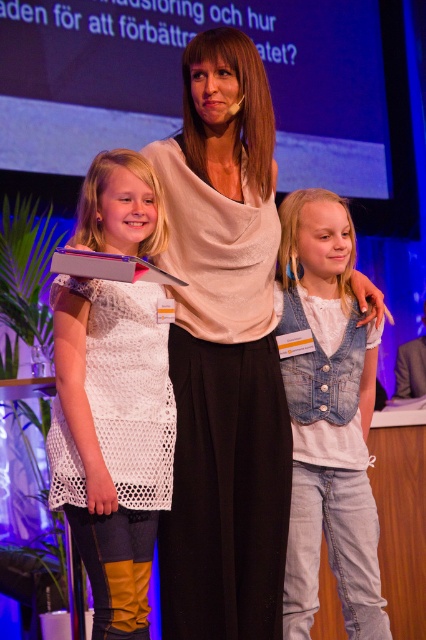
From the picture: You are attending this event and want to take a photo of both the matte white blouse at center and the white crochet dress at center. Which one should you focus on first if you want to capture them in order from left to right?

The white crochet dress at center is on the left side, so you should focus on it first to capture them in order from left to right.

You are an event planner arranging a photoshoot at the event. You need to ensure the matte white blouse at center and denim vest at center are visible in the photo. Which object should be positioned closer to the camera to ensure both are visible?

The matte white blouse at center should be positioned closer to the camera since it is in front of the denim vest at center, ensuring both are visible without one blocking the other.